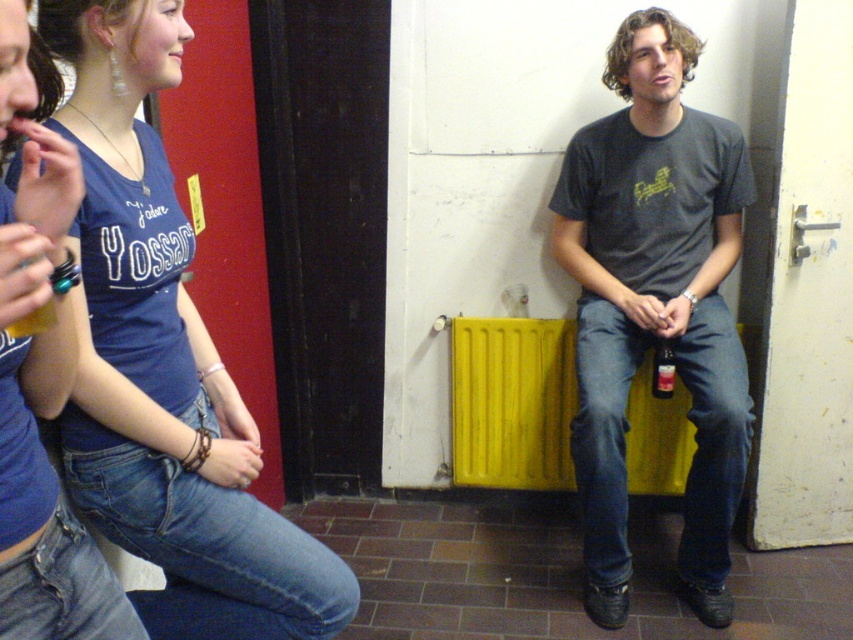
Between point (294, 566) and point (505, 464), which one is positioned in front?

Point (294, 566)

At what (x,y) coordinates should I click in order to perform the action: click on blue denim jeans at lower left. Please return your answer as a coordinate pair (x, y). Looking at the image, I should click on (166, 365).

Between dark gray t-shirt at center and yellow matte radiator at center, which one has less height?

yellow matte radiator at center

Who is positioned more to the right, dark gray t-shirt at center or yellow matte radiator at center?

From the viewer's perspective, dark gray t-shirt at center appears more on the right side.

Which is behind, point (604, 220) or point (558, 394)?

Positioned behind is point (558, 394).

The image size is (853, 640). I want to click on dark gray t-shirt at center, so click(x=654, y=304).

Which is behind, point (535, 433) or point (659, 369)?

The point (535, 433) is behind.

Does yellow matte radiator at center appear under translucent glass bottle at center?

Yes, yellow matte radiator at center is below translucent glass bottle at center.

Is point (682, 483) closer to camera compared to point (666, 380)?

No.

Find the location of a particular element. This screenshot has height=640, width=853. yellow matte radiator at center is located at coordinates (512, 403).